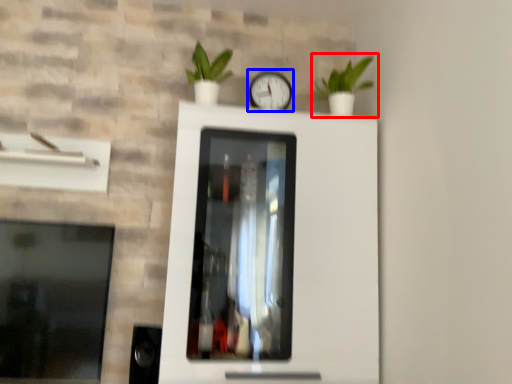
Question: Which point is closer to the camera, houseplant (highlighted by a red box) or clock (highlighted by a blue box)?

Choices:
 (A) houseplant
 (B) clock

Answer: (A)